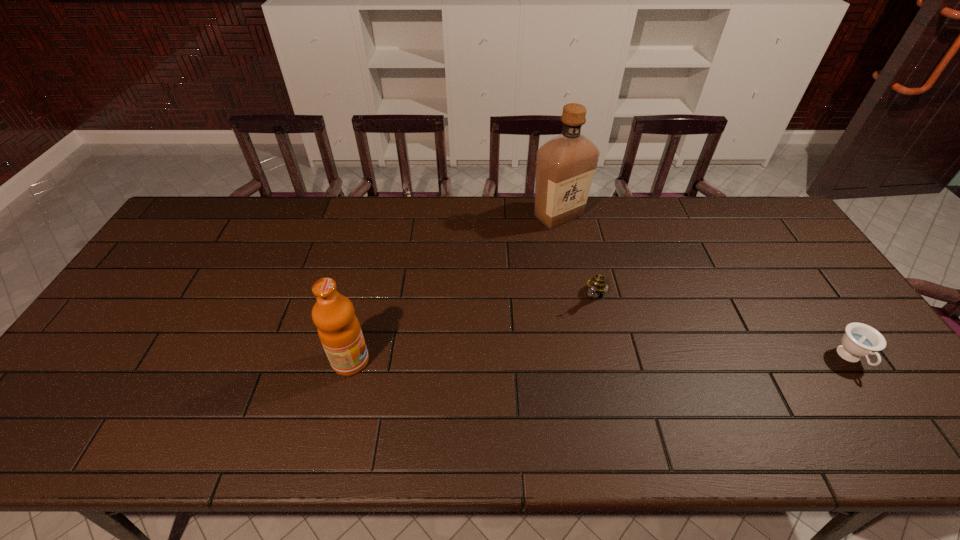
Identify the location of vacant space located 0.240m on the face of the second shortest object. (558, 373).

At what (x,y) coordinates should I click in order to perform the action: click on vacant region located on the face of the second shortest object. Please return your answer as a coordinate pair (x, y). Image resolution: width=960 pixels, height=540 pixels. Looking at the image, I should click on (546, 396).

Find the location of a particular element. Image resolution: width=960 pixels, height=540 pixels. blank space located on the face of the second shortest object is located at coordinates (555, 380).

Where is `vacant space located 0.290m on the front-facing side of the tallest object`? Image resolution: width=960 pixels, height=540 pixels. vacant space located 0.290m on the front-facing side of the tallest object is located at coordinates (572, 298).

The width and height of the screenshot is (960, 540). In order to click on free location located on the front-facing side of the tallest object in this screenshot , I will do `click(577, 326)`.

Image resolution: width=960 pixels, height=540 pixels. I want to click on vacant space located on the front-facing side of the tallest object, so [x=565, y=255].

Identify the location of object at the far edge. This screenshot has height=540, width=960. (565, 165).

Where is `fruit juice present at the near edge`? The height and width of the screenshot is (540, 960). fruit juice present at the near edge is located at coordinates (339, 330).

This screenshot has width=960, height=540. Find the location of `teacup that is positioned at the near edge`. teacup that is positioned at the near edge is located at coordinates (860, 340).

Image resolution: width=960 pixels, height=540 pixels. In order to click on object present at the right edge in this screenshot , I will do `click(860, 340)`.